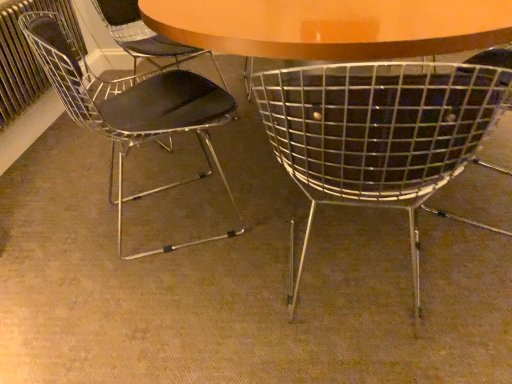
Where is `vacant area situated below metallic radiator at left (from a real-world perspective)`? vacant area situated below metallic radiator at left (from a real-world perspective) is located at coordinates (42, 142).